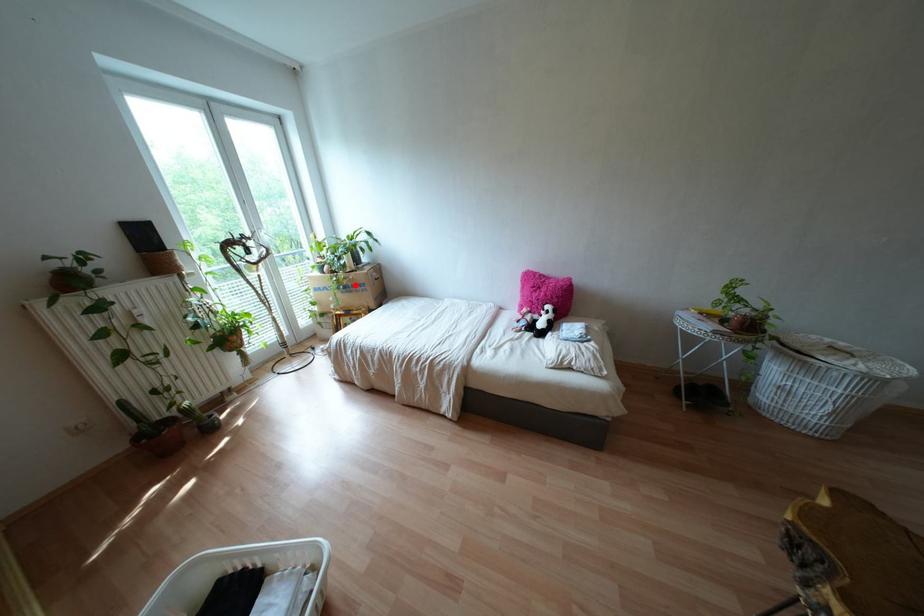
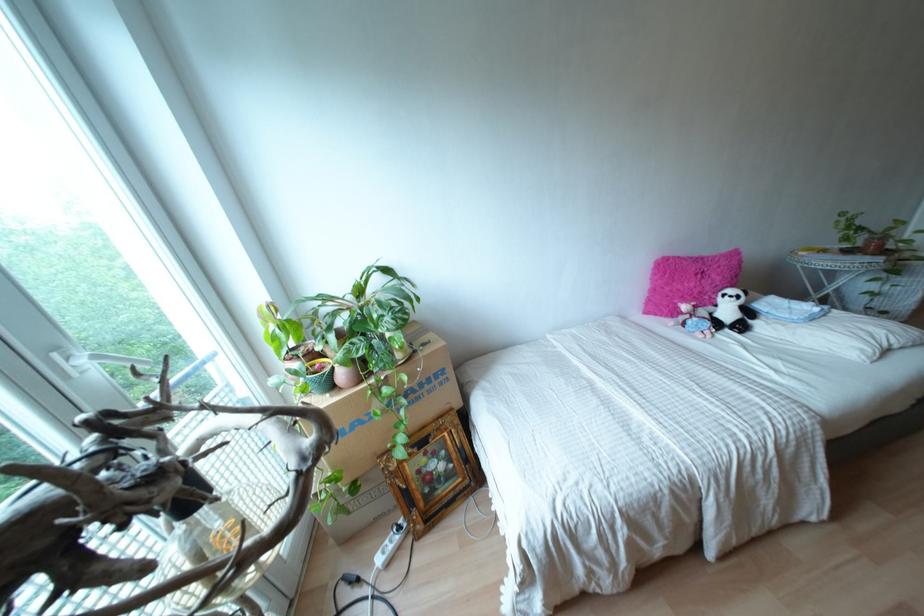
Where in the second image is the point corresponding to the highlighted location from the first image?

(428, 379)